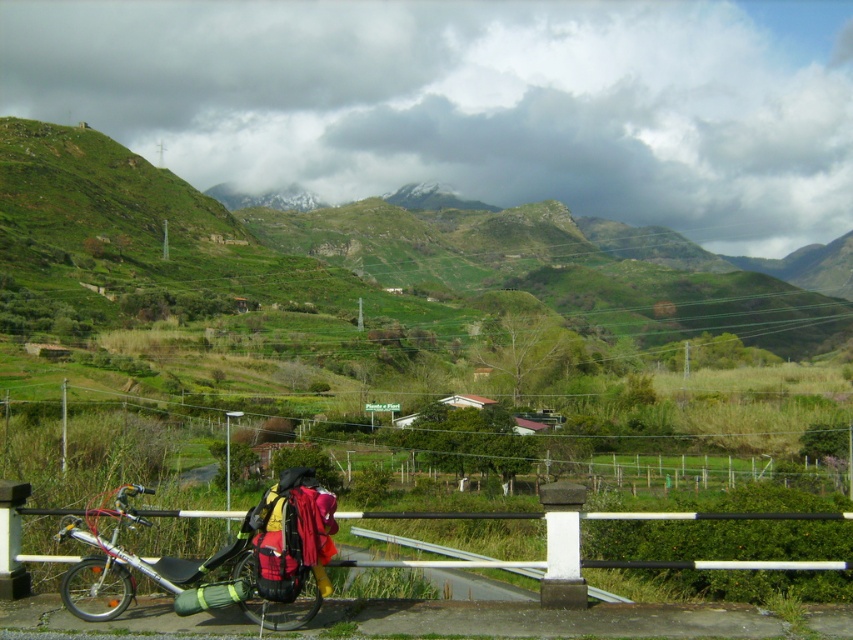
Is point (109, 561) more distant than point (730, 563)?

No, it is not.

Does metallic silver bicycle at lower left come in front of white metal rail at lower left?

Yes, it is.

You are a GUI agent. You are given a task and a screenshot of the screen. Output one action in this format:
    pyautogui.click(x=<x>, y=<y>)
    Task: Click on the metallic silver bicycle at lower left
    This screenshot has width=853, height=640.
    Given the screenshot: What is the action you would take?
    pyautogui.click(x=190, y=572)